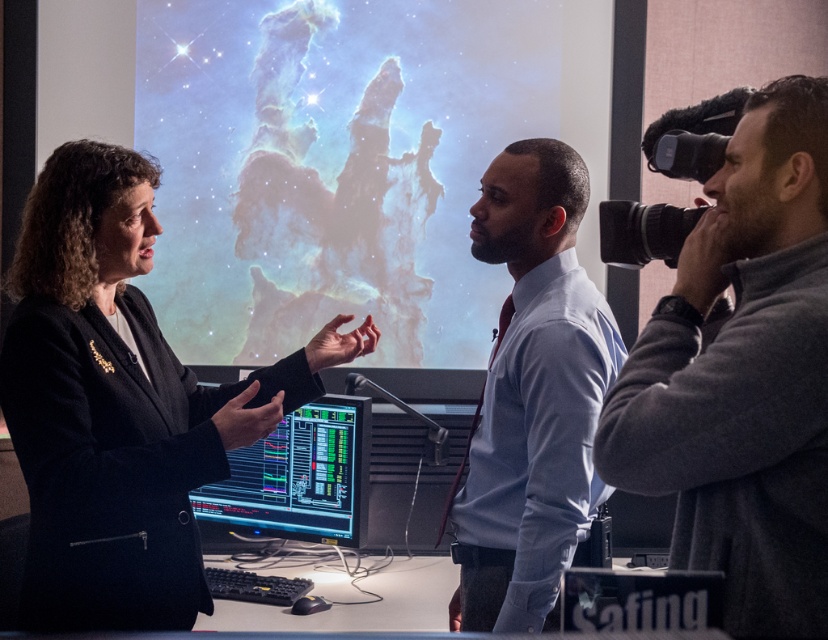
Question: Estimate the real-world distances between objects in this image. Which object is farther from the light blue shirt at center?

Choices:
 (A) gray fleece jacket at right
 (B) shiny black monitor at center

Answer: (B)

Question: Can you confirm if gray fleece jacket at right is positioned below shiny black monitor at center?

Choices:
 (A) yes
 (B) no

Answer: (B)

Question: Which of these objects is positioned closest to the shiny black monitor at center?

Choices:
 (A) light blue shirt at center
 (B) gray fleece jacket at right

Answer: (A)

Question: Which of the following is the farthest from the observer?

Choices:
 (A) (295, 480)
 (B) (807, 257)
 (C) (530, 420)

Answer: (A)

Question: Is light blue shirt at center wider than shiny black monitor at center?

Choices:
 (A) no
 (B) yes

Answer: (A)

Question: Is light blue shirt at center to the right of shiny black monitor at center from the viewer's perspective?

Choices:
 (A) no
 (B) yes

Answer: (B)